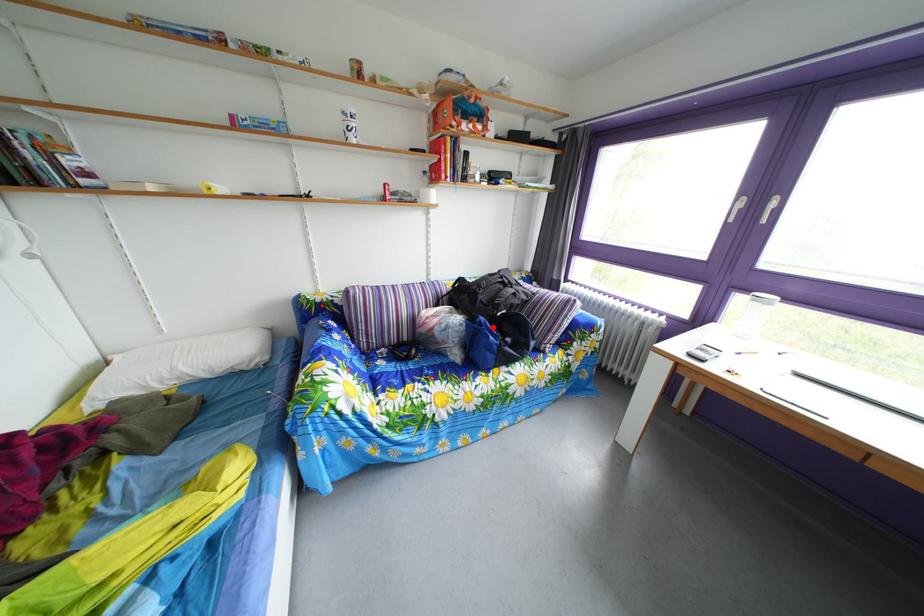
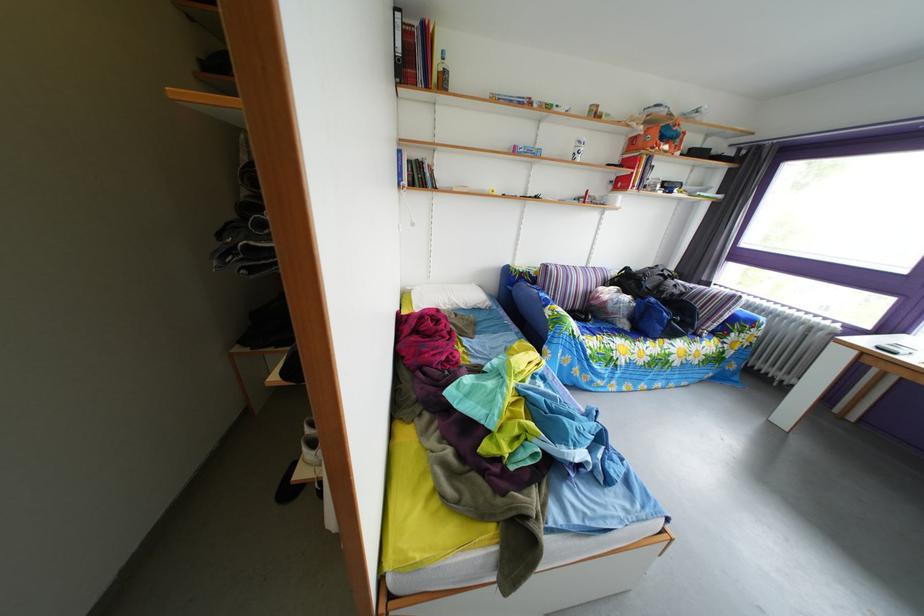
Question: I am providing you with two images of the same scene from different viewpoints. In image1, a red point is highlighted. Considering the same 3D point in image2, which of the following is correct?

Choices:
 (A) It is closer
 (B) It is farther

Answer: (A)